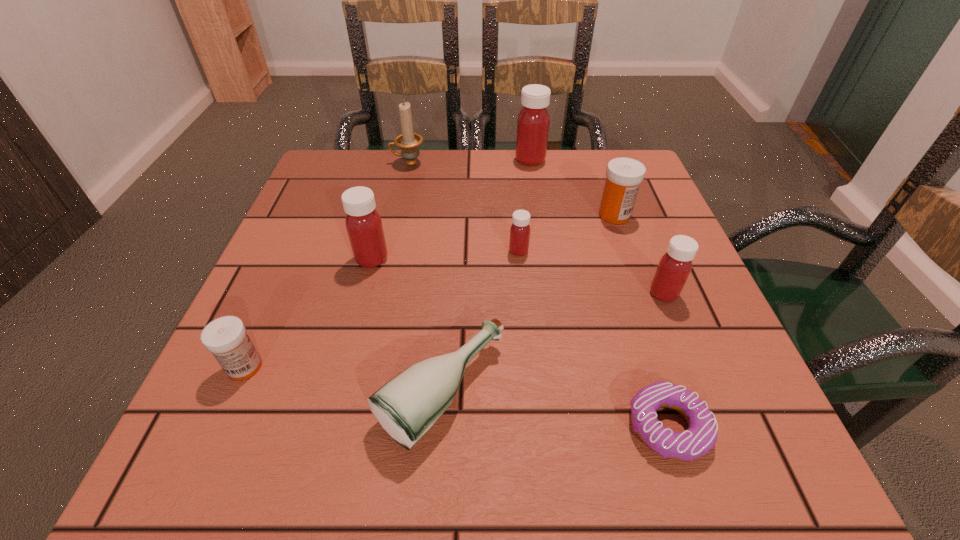
Image resolution: width=960 pixels, height=540 pixels. I want to click on free space that is in between the bigger white medicine and the candle_holder, so click(x=512, y=189).

This screenshot has height=540, width=960. I want to click on free space between the candle_holder and the smallest red medicine, so click(464, 207).

The height and width of the screenshot is (540, 960). Find the location of `vacant space that's between the second smallest red medicine and the candle_holder`. vacant space that's between the second smallest red medicine and the candle_holder is located at coordinates click(536, 228).

You are a GUI agent. You are given a task and a screenshot of the screen. Output one action in this format:
    pyautogui.click(x=<x>, y=<y>)
    Task: Click on the blank region between the bigger white medicine and the smallest red medicine
    This screenshot has width=960, height=540.
    Given the screenshot: What is the action you would take?
    pyautogui.click(x=566, y=233)

In order to click on unoccupied area between the candle_holder and the smallest red medicine in this screenshot , I will do `click(464, 207)`.

Image resolution: width=960 pixels, height=540 pixels. Identify the location of vacant point located between the tallest medicine and the sixth farthest object. (597, 227).

At what (x,y) coordinates should I click in order to perform the action: click on free space between the bottle and the farthest red medicine. Please return your answer as a coordinate pair (x, y). Image resolution: width=960 pixels, height=540 pixels. Looking at the image, I should click on (486, 276).

Image resolution: width=960 pixels, height=540 pixels. Identify the location of vacant area between the purple doughnut and the seventh nearest object. (641, 320).

Where is `empty space that is in between the leftmost red medicine and the candle_holder`? Image resolution: width=960 pixels, height=540 pixels. empty space that is in between the leftmost red medicine and the candle_holder is located at coordinates (390, 211).

The height and width of the screenshot is (540, 960). I want to click on object that is the third nearest to the biggest red medicine, so click(x=520, y=230).